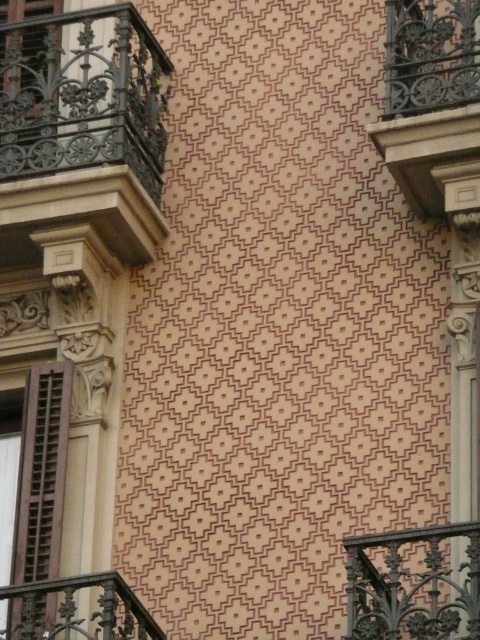
You are standing in front of the building and want to hang a small plant hanger. The plant hanger needs to be placed below the dark brown wrought iron balcony at upper left and above the brown wooden shutter at left. Is this possible?

The dark brown wrought iron balcony at upper left is above the brown wooden shutter at left, so there is space between them where the plant hanger can be placed.

You are standing in front of the building wall and want to determine the spatial relationship between the two points marked on the wall. Which point is closer to you, point at position (137, 204) or point at position (373, 132)?

Point at position (373, 132) is closer to you because the description states that point at position (137, 204) is behind point at position (373, 132).